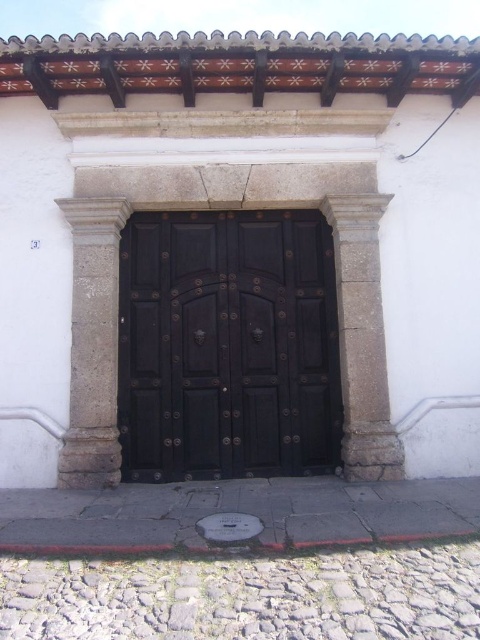
You are standing in front of the building entrance. You need to enter the building but the door is locked. You decide to look for a key hidden somewhere near the entrance. According to the image, where could the key possibly be located relative to the black wood door at center and the gray stone pillar at left?

The key could be located above the black wood door at center since it is positioned under the gray stone pillar at left, which might have a crevice or decorative element where the key is hidden.

You are an architect designing a new building entrance and want to ensure the door is proportionate to the pillars. Given the black wood door at center and the gray stone pillar at left in the reference image, which one is wider?

The black wood door at center is wider than the gray stone pillar at left according to the description.

You are standing in front of the building entrance. Where is the black wood door at center located in the image?

The black wood door at center is located at point [228,346] in the image.